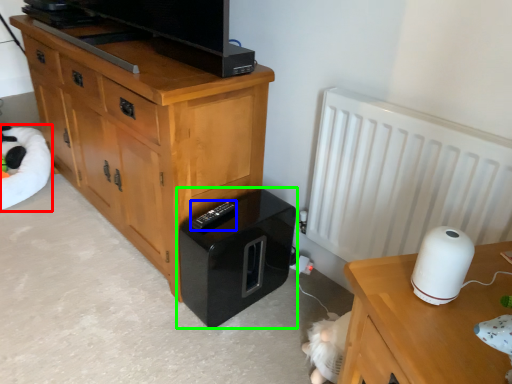
Question: Which is nearer to the bean bag chair (highlighted by a red box)? remote (highlighted by a blue box) or home appliance (highlighted by a green box).

Choices:
 (A) remote
 (B) home appliance

Answer: (B)